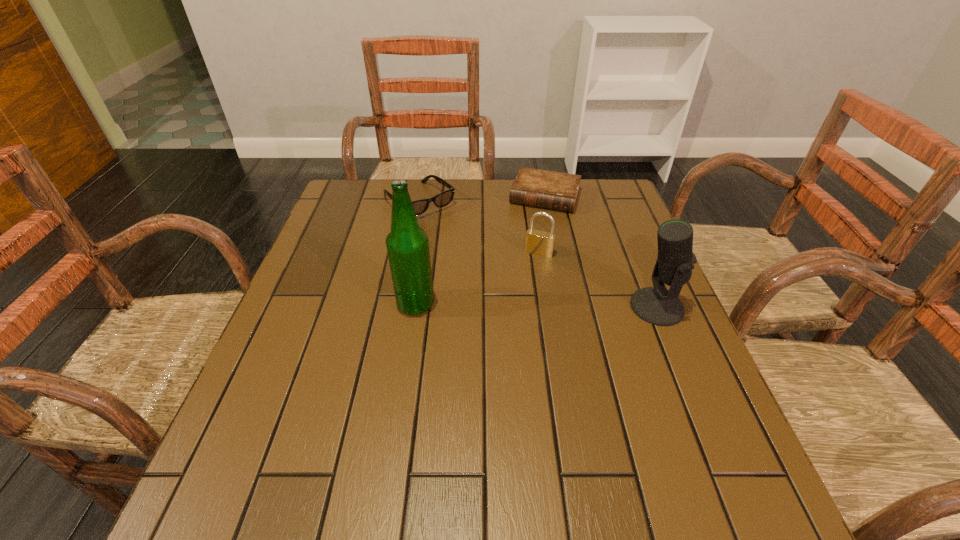
Where is `free space located on the spine side of the shortest object`? free space located on the spine side of the shortest object is located at coordinates (534, 224).

Identify the location of blank space located on the spine side of the shortest object. (516, 273).

The width and height of the screenshot is (960, 540). I want to click on vacant area situated on the spine side of the shortest object, so click(x=517, y=268).

Identify the location of vacant space located on the lenses of the fourth tallest object. (467, 248).

Find the location of `free space located on the lenses of the fourth tallest object`. free space located on the lenses of the fourth tallest object is located at coordinates (447, 230).

Where is `free space located 0.340m on the lenses of the fourth tallest object`? The width and height of the screenshot is (960, 540). free space located 0.340m on the lenses of the fourth tallest object is located at coordinates (507, 287).

The width and height of the screenshot is (960, 540). Identify the location of blank space located 0.160m on the front-facing side of the third tallest object. (517, 298).

Find the location of `vacant region located 0.080m on the front-facing side of the third tallest object`. vacant region located 0.080m on the front-facing side of the third tallest object is located at coordinates (527, 276).

The height and width of the screenshot is (540, 960). Identify the location of free region located on the front-facing side of the third tallest object. (495, 352).

What are the coordinates of `diary present at the far edge` in the screenshot? It's located at (546, 189).